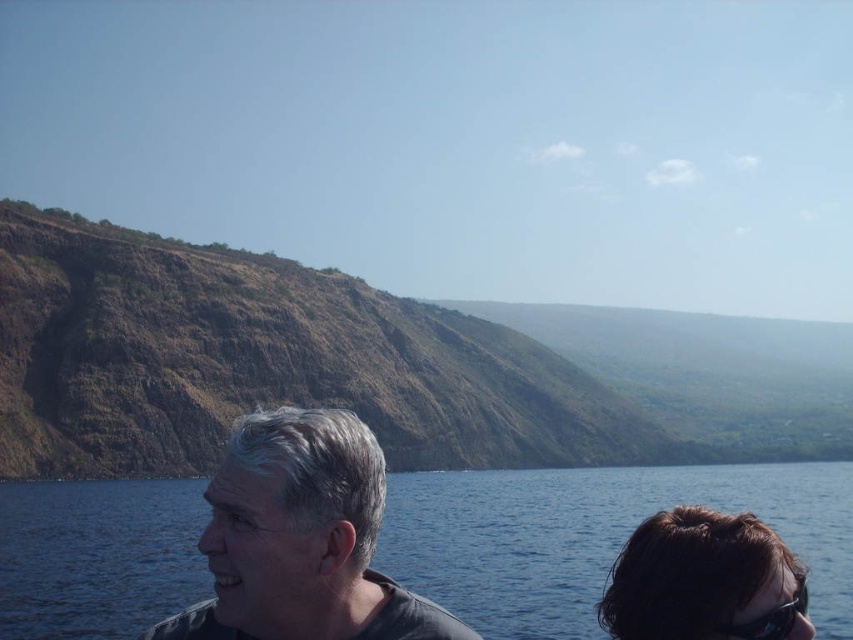
You are a swimmer preparing to dive into the blue water at lower center. You see the black plastic goggles at lower right. Are the goggles positioned above or below the water?

The blue water at lower center is located below the black plastic goggles at lower right, so the goggles are positioned above the water.

You are a photographer standing at the center of the scene. You want to take a photo that includes both the gray matte hair at center and the black plastic goggles at lower right. Considering their distance apart, will you be able to frame both in the same shot without moving your position?

The gray matte hair at center is 7.68 meters away from the black plastic goggles at lower right. Since the photographer is at the center, the distance between the two objects is manageable to frame both in the same shot without moving.

You are a photographer planning to capture a wide shot of the blue water at lower center and the black plastic goggles at lower right. Given their sizes, which object should you focus on first to ensure both are clearly visible in the frame?

The blue water at lower center is larger in size than the black plastic goggles at lower right, so you should focus on the blue water at lower center first to ensure both are clearly visible in the frame.